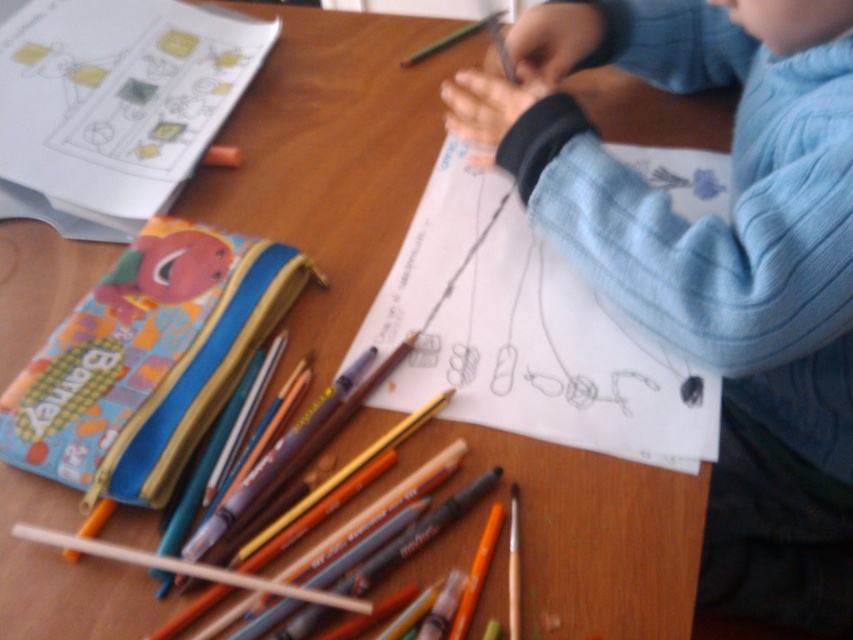
Can you confirm if white paper at center is positioned above white paper at upper left?

Actually, white paper at center is below white paper at upper left.

Which is above, white paper at center or white paper at upper left?

Positioned higher is white paper at upper left.

Who is more forward, (570, 384) or (138, 212)?

Point (570, 384)

Locate an element on the screen. white paper at center is located at coordinates (526, 333).

Does white paper at upper left have a lesser height compared to orange matte crayon at lower center?

In fact, white paper at upper left may be taller than orange matte crayon at lower center.

Does point (7, 10) come farther from viewer compared to point (463, 618)?

Yes, it is.

In order to click on white paper at upper left in this screenshot , I will do `click(113, 104)`.

Does white paper at center lie behind orange matte crayon at lower center?

Yes, white paper at center is further from the viewer.

Is white paper at center to the right of orange matte crayon at lower center from the viewer's perspective?

Correct, you'll find white paper at center to the right of orange matte crayon at lower center.

Who is more distant from viewer, (602, 422) or (474, 584)?

Point (602, 422)

The width and height of the screenshot is (853, 640). I want to click on white paper at center, so click(526, 333).